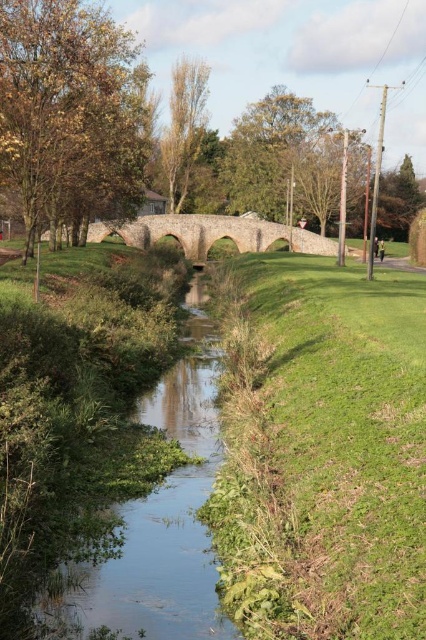
You are standing at the stone bridge and want to take a photo of both point (374, 339) and point (187, 467) in the scene. Which point should you focus on first to ensure both are in clear view?

You should focus on point (374, 339) first because it is closer to the camera than point (187, 467), ensuring both points are in focus.

You are a hiker who wants to cross the stream without getting your shoes wet. You see green grass at center and green grassy stream at center. Which path should you take to stay dry?

You should take the green grass at center because it is in front of the green grassy stream at center, meaning it is closer to you and not part of the water.

You are standing at the origin point of the image and want to walk to the green grass at center. According to the coordinates provided, in which direction should you move to reach it?

The green grass at center is located at coordinates approximately 0.705 on the x and 0.754 on the y axis. Since the origin is at the bottom left corner, moving towards the upper right direction will lead you to the green grass at center.